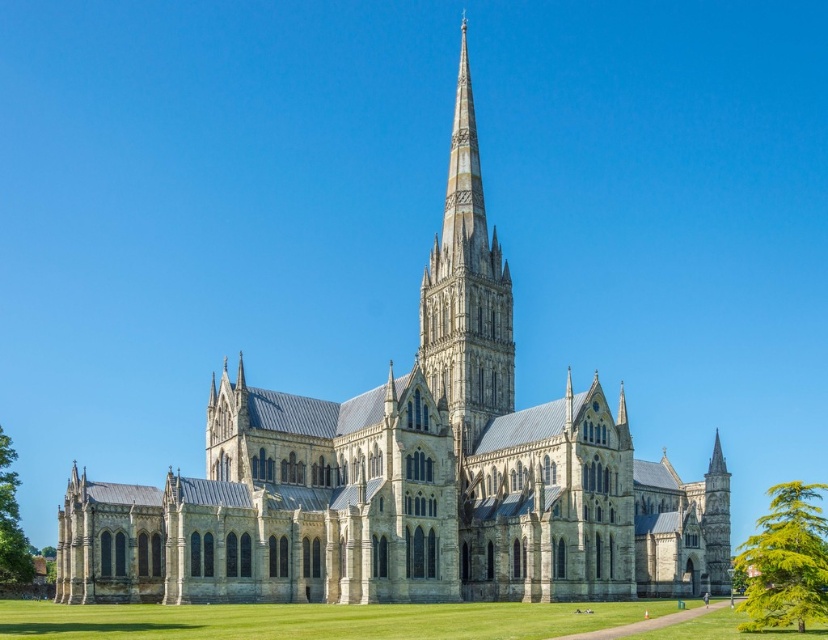
Question: Which point is closer to the camera?

Choices:
 (A) (461, 227)
 (B) (773, 566)
 (C) (100, 637)
 (D) (12, 572)

Answer: (C)

Question: Is gray stone spire at center further to the viewer compared to green leafy tree at lower right?

Choices:
 (A) no
 (B) yes

Answer: (B)

Question: Does green grass at lower center have a lesser width compared to green leafy tree at lower left?

Choices:
 (A) yes
 (B) no

Answer: (A)

Question: Is gray stone spire at center below green leafy tree at lower right?

Choices:
 (A) no
 (B) yes

Answer: (A)

Question: Which object is farther from the camera taking this photo?

Choices:
 (A) green leafy tree at lower left
 (B) green leafy tree at lower right

Answer: (A)

Question: Estimate the real-world distances between objects in this image. Which object is farther from the green leafy tree at lower right?

Choices:
 (A) green leafy tree at lower left
 (B) gray stone spire at center
 (C) green grass at lower center

Answer: (A)